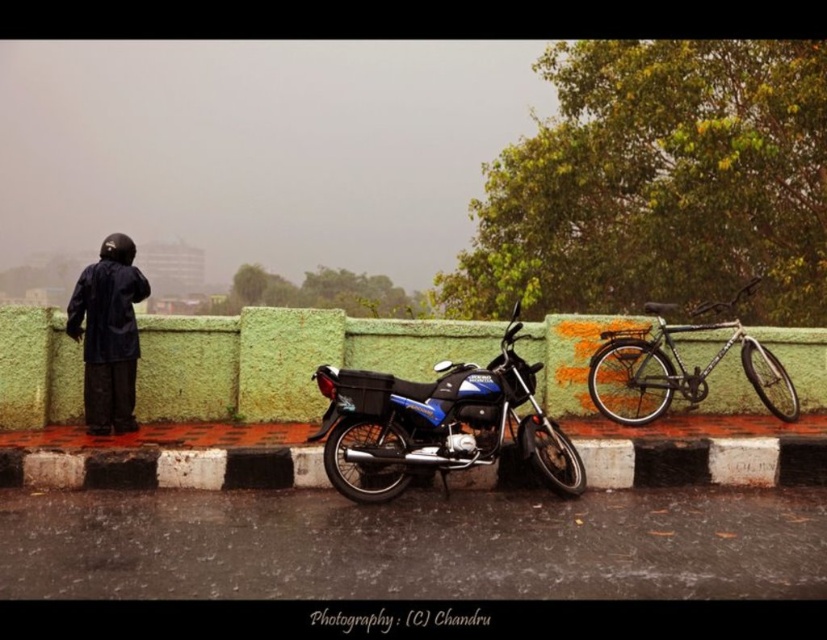
You are a delivery person needing to place a package on the black rubber curb at lower center. Considering the height of the blue metallic motorcycle at center, do you think the curb is tall enough to prevent the package from sliding off?

The black rubber curb at lower center is not as tall as the blue metallic motorcycle at center, so it might not be tall enough to prevent the package from sliding off.

You are a pedestrian trying to cross the road safely. You see the green concrete barrier at center and the black matte jacket at left. Which object is closer to you as you approach the road?

The green concrete barrier at center is closer to you because the black matte jacket at left is behind it.